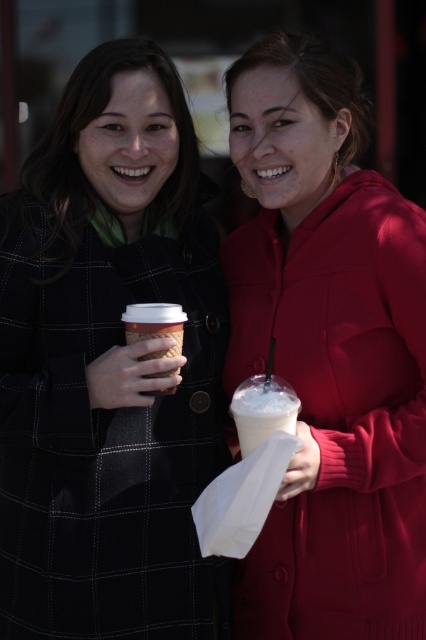
Looking at this image, does matte red hoodie at right appear on the right side of white frothy drink at center?

Correct, you'll find matte red hoodie at right to the right of white frothy drink at center.

Does matte red hoodie at right have a greater width compared to white frothy drink at center?

Correct, the width of matte red hoodie at right exceeds that of white frothy drink at center.

Does point (235, 385) lie in front of point (293, 397)?

That is False.

This screenshot has width=426, height=640. I want to click on matte red hoodie at right, so click(x=328, y=353).

Is matte black coat at left below matte red hoodie at right?

Yes.

Locate an element on the screen. matte black coat at left is located at coordinates (109, 365).

Identify the location of matte black coat at left. (109, 365).

The width and height of the screenshot is (426, 640). What do you see at coordinates (328, 353) in the screenshot? I see `matte red hoodie at right` at bounding box center [328, 353].

Is point (275, 120) positioned in front of point (124, 324)?

No, (275, 120) is behind (124, 324).

Find the location of a particular element. matte red hoodie at right is located at coordinates (328, 353).